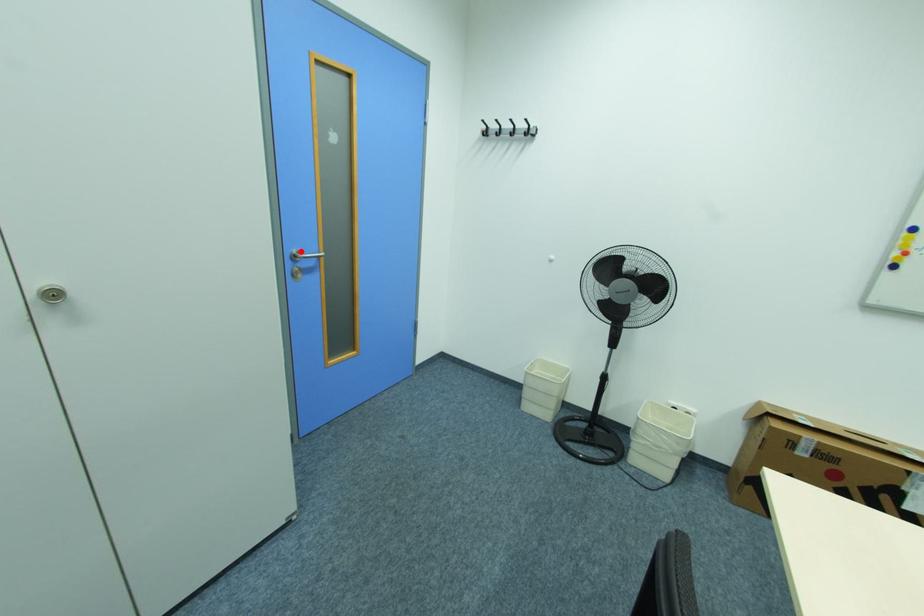
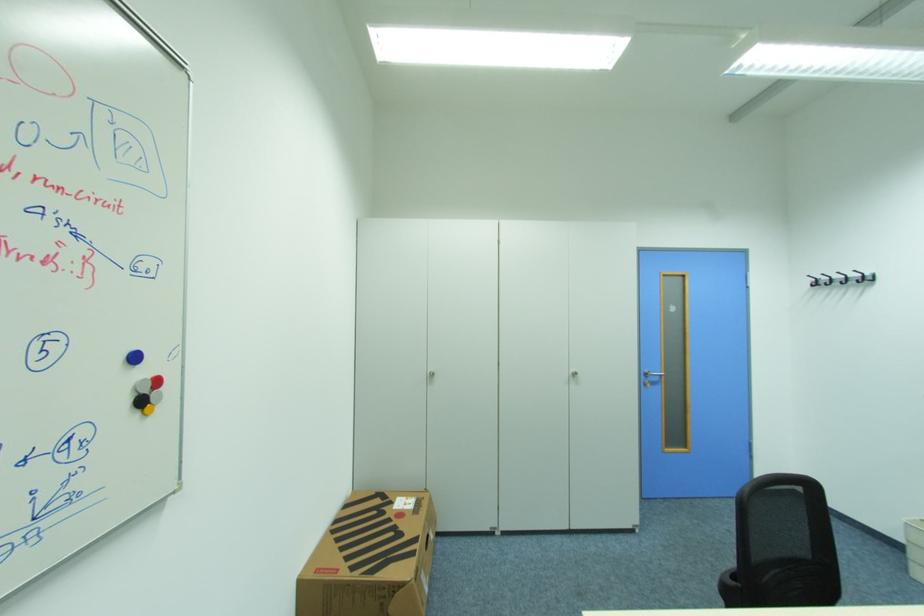
In the second image, find the point that corresponds to the highlighted location in the first image.

(651, 371)